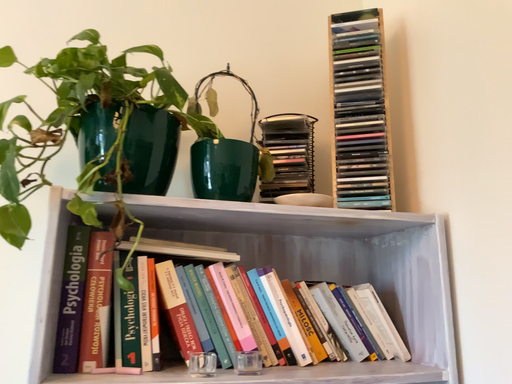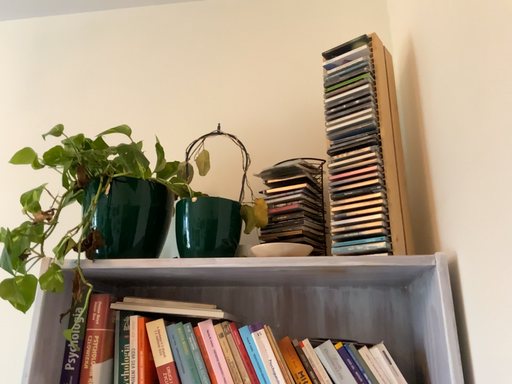
Question: How did the camera likely rotate when shooting the video?

Choices:
 (A) rotated right
 (B) rotated left

Answer: (B)